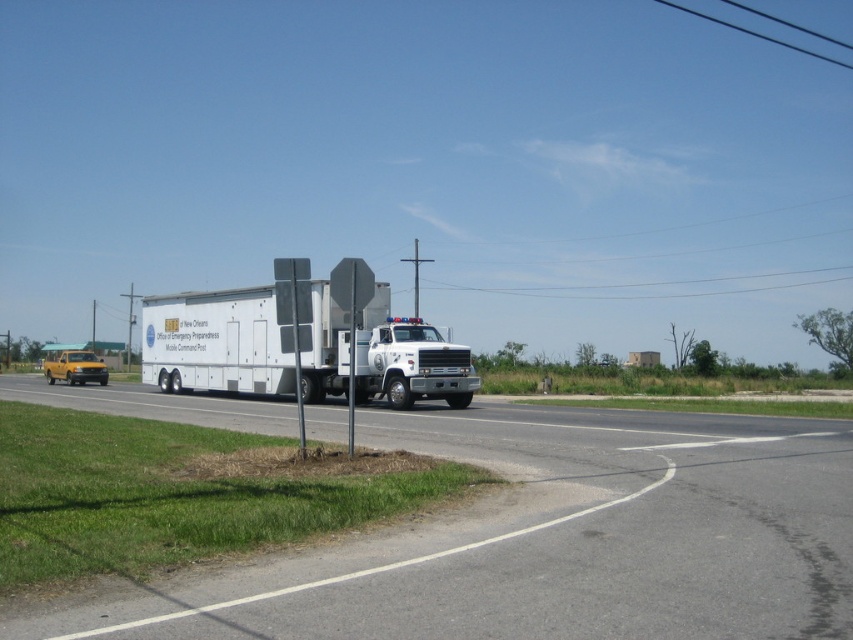
You are a delivery driver who needs to park your van behind the white matte trailer truck at center. The van is 1.2 meters tall. Can you safely park your van behind the truck without hitting the asphalt road at center?

The asphalt road at center has a lesser height compared to white matte trailer truck at center. Since the road is lower than the truck, parking behind the truck would mean driving onto the road, which is already at a lower height. Therefore, your van should fit as long as there is enough space on the road. However, ensure there is sufficient clearance and space behind the truck on the asphalt road for your van to park safely.

You are a delivery driver planning to park your truck, which is 2.5 meters wide, on the asphalt road at center. The white matte trailer truck at center is already parked there. Can your truck fit alongside it without overlapping?

The asphalt road at center is wider than the white matte trailer truck at center, so yes, your truck can fit alongside it without overlapping since the road has enough width.

You are a driver approaching the scene and need to determine the position of the asphalt road at center relative to the white matte trailer truck at center. Which side of the truck is the road located on?

The asphalt road at center is to the right of the white matte trailer truck at center.